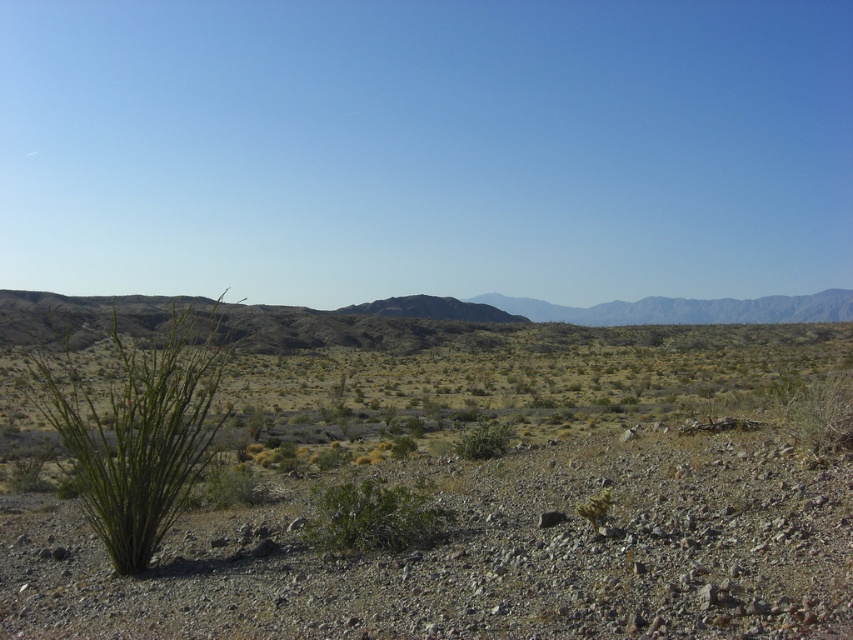
Can you confirm if green shrub at center is positioned below green leafy bush at center?

Indeed, green shrub at center is positioned under green leafy bush at center.

Locate an element on the screen. The height and width of the screenshot is (640, 853). green shrub at center is located at coordinates (489, 497).

In order to click on green shrub at center in this screenshot , I will do `click(489, 497)`.

You are a GUI agent. You are given a task and a screenshot of the screen. Output one action in this format:
    pyautogui.click(x=<x>, y=<y>)
    Task: Click on the green shrub at center
    The image size is (853, 640).
    Given the screenshot: What is the action you would take?
    pyautogui.click(x=489, y=497)

Which is in front, point (329, 493) or point (602, 508)?

Positioned in front is point (602, 508).

Is point (315, 522) closer to camera compared to point (601, 502)?

That is False.

In order to click on green leafy bush at center in this screenshot , I will do `click(375, 515)`.

Does green spiny plant at left have a greater width compared to green spiky bush at lower right?

Yes.

Does green spiny plant at left lie behind green spiky bush at lower right?

Yes, it is behind green spiky bush at lower right.

Describe the element at coordinates (137, 432) in the screenshot. I see `green spiny plant at left` at that location.

Identify the location of green spiny plant at left. (137, 432).